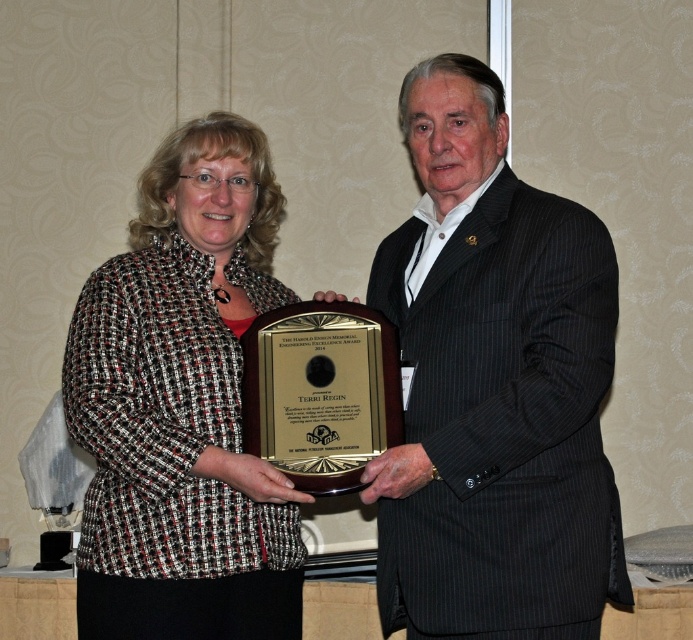
You are a GUI agent. You are given a task and a screenshot of the screen. Output one action in this format:
    pyautogui.click(x=<x>, y=<y>)
    Task: Click on the black pinstripe suit at center
    Image resolution: width=693 pixels, height=640 pixels.
    Given the screenshot: What is the action you would take?
    pyautogui.click(x=493, y=387)

Does black pinstripe suit at center appear under tweed jacket at center?

No.

Describe the element at coordinates (493, 387) in the screenshot. Image resolution: width=693 pixels, height=640 pixels. I see `black pinstripe suit at center` at that location.

The image size is (693, 640). Identify the location of black pinstripe suit at center. (493, 387).